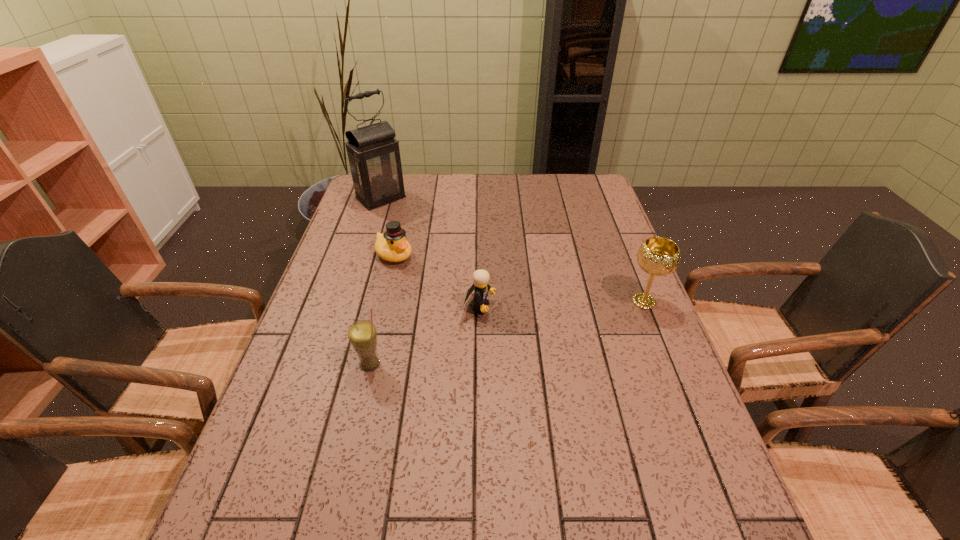
Identify the location of free region that satisfies the following two spatial constraints: 1. on the front side of the fourth nearest object; 2. on the right side of the tallest object. Image resolution: width=960 pixels, height=540 pixels. (362, 255).